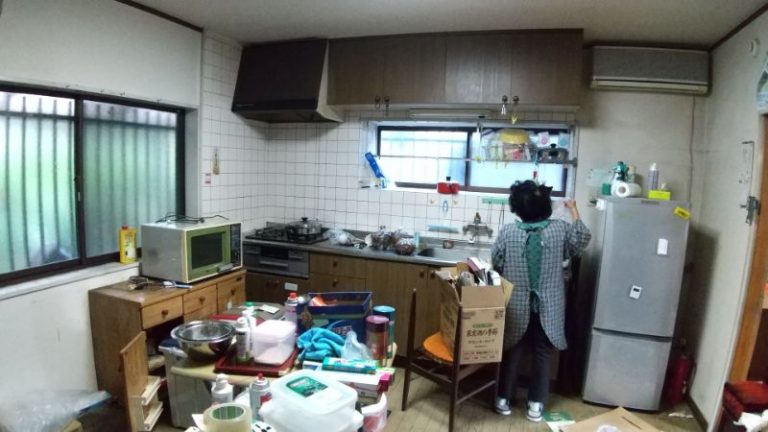
You are a GUI agent. You are given a task and a screenshot of the screen. Output one action in this format:
    pyautogui.click(x=<x>, y=<y>)
    Task: Click on the plastic box
    This screenshot has height=432, width=768.
    Given the screenshot: What is the action you would take?
    267,350